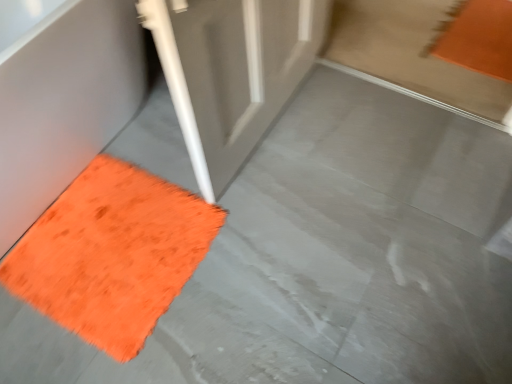
Question: Would you consider orange shaggy bath mat at lower left to be distant from orange fuzzy mat at lower left?

Choices:
 (A) yes
 (B) no

Answer: (B)

Question: Is orange shaggy bath mat at lower left at the right side of orange fuzzy mat at lower left?

Choices:
 (A) yes
 (B) no

Answer: (B)

Question: Is orange shaggy bath mat at lower left smaller than orange fuzzy mat at lower left?

Choices:
 (A) no
 (B) yes

Answer: (A)

Question: Is orange shaggy bath mat at lower left not inside orange fuzzy mat at lower left?

Choices:
 (A) no
 (B) yes

Answer: (B)

Question: Does orange shaggy bath mat at lower left appear on the left side of orange fuzzy mat at lower left?

Choices:
 (A) no
 (B) yes

Answer: (B)

Question: From a real-world perspective, is orange shaggy bath mat at lower left located higher than orange fuzzy mat at lower left?

Choices:
 (A) yes
 (B) no

Answer: (A)

Question: Can you confirm if orange fuzzy mat at lower left is smaller than orange shaggy bath mat at lower left?

Choices:
 (A) no
 (B) yes

Answer: (B)

Question: From the image's perspective, is orange fuzzy mat at lower left over orange shaggy bath mat at lower left?

Choices:
 (A) no
 (B) yes

Answer: (A)

Question: Is orange fuzzy mat at lower left turned away from orange shaggy bath mat at lower left?

Choices:
 (A) yes
 (B) no

Answer: (B)

Question: Is orange fuzzy mat at lower left shorter than orange shaggy bath mat at lower left?

Choices:
 (A) yes
 (B) no

Answer: (A)

Question: From a real-world perspective, is orange fuzzy mat at lower left physically below orange shaggy bath mat at lower left?

Choices:
 (A) no
 (B) yes

Answer: (B)

Question: Is orange fuzzy mat at lower left further to the viewer compared to orange shaggy bath mat at lower left?

Choices:
 (A) no
 (B) yes

Answer: (B)

Question: Considering the positions of point (10, 117) and point (82, 292), is point (10, 117) closer or farther from the camera than point (82, 292)?

Choices:
 (A) closer
 (B) farther

Answer: (A)